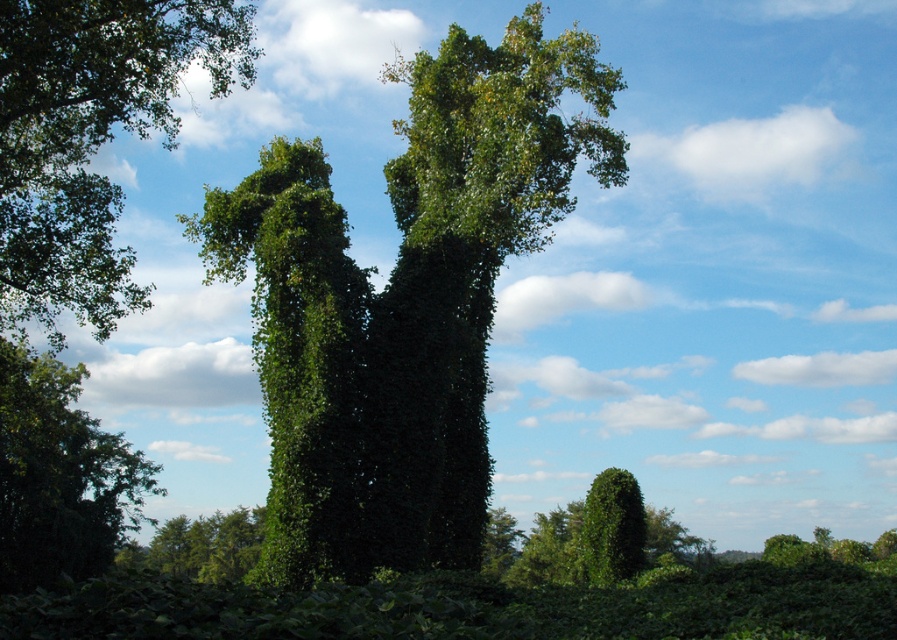
Question: Which is farther from the green leafy bush at lower left?

Choices:
 (A) green leafy tree at center
 (B) green leafy tree at upper left

Answer: (A)

Question: In this image, where is green leafy tree at center located relative to green leafy bush at lower left?

Choices:
 (A) below
 (B) above

Answer: (B)

Question: Which of the following is the closest to the observer?

Choices:
 (A) green leafy bush at lower left
 (B) green leafy tree at upper left

Answer: (B)

Question: Where is green leafy tree at center located in relation to green leafy bush at lower left in the image?

Choices:
 (A) above
 (B) below

Answer: (A)

Question: Can you confirm if green leafy tree at center is bigger than green leafy tree at upper left?

Choices:
 (A) yes
 (B) no

Answer: (B)

Question: Among these objects, which one is nearest to the camera?

Choices:
 (A) green leafy bush at lower left
 (B) green leafy tree at upper left
 (C) green leafy tree at center

Answer: (B)